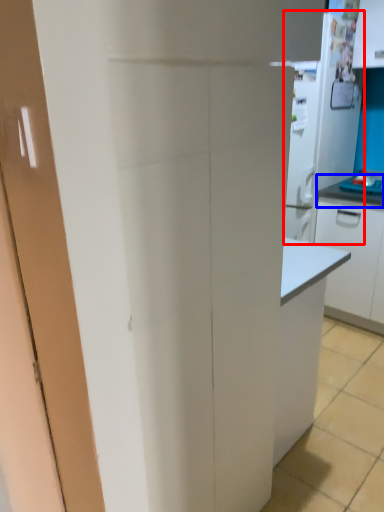
Question: Which of the following is the farthest to the observer, appliance (highlighted by a red box) or countertop (highlighted by a blue box)?

Choices:
 (A) appliance
 (B) countertop

Answer: (B)